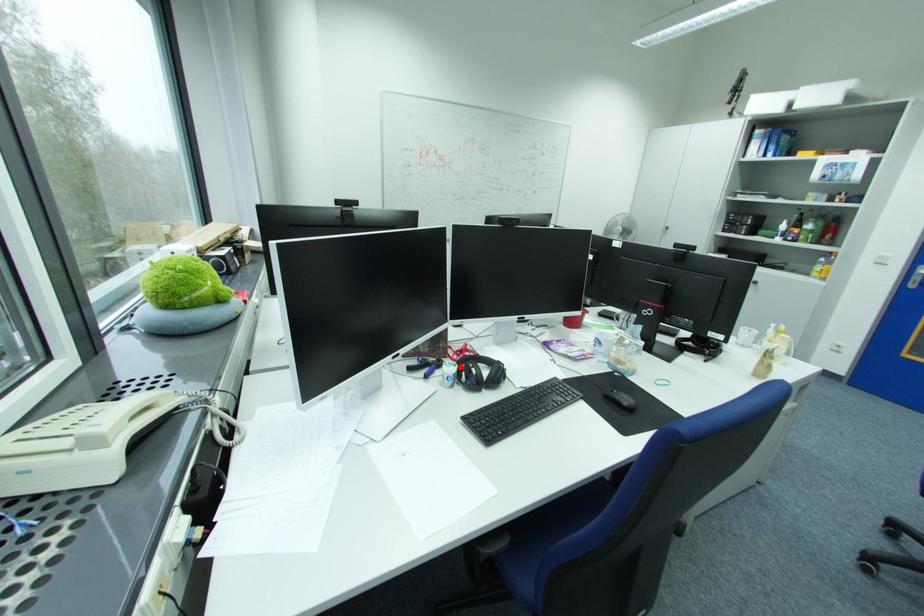
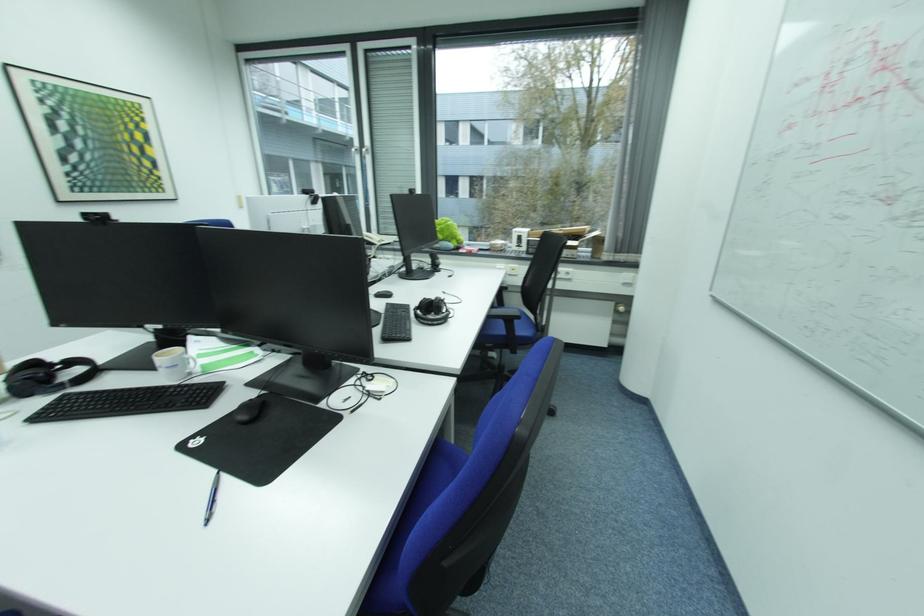
Question: I am providing you with two images of the same scene from different viewpoints. A red point is marked on the first image. Is the red point's position out of view in image 2?

Choices:
 (A) Yes
 (B) No

Answer: (A)